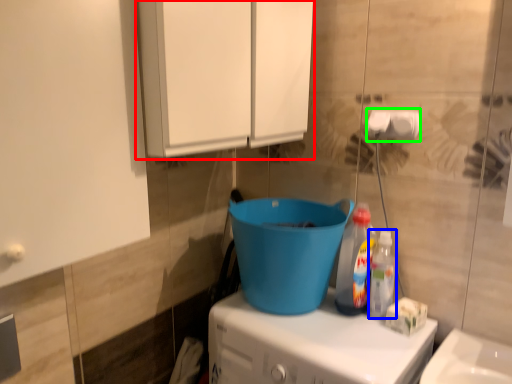
Question: Based on their relative distances, which object is nearer to cabinetry (highlighted by a red box)? Choose from bottle (highlighted by a blue box) and toilet paper (highlighted by a green box).

Choices:
 (A) bottle
 (B) toilet paper

Answer: (B)